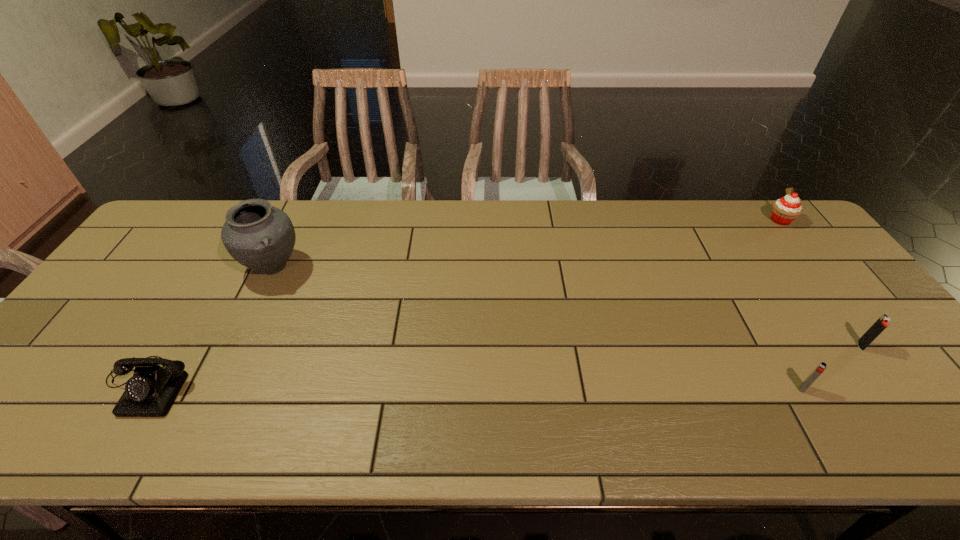
Find the location of a particular element. The height and width of the screenshot is (540, 960). blank space located on the front of the farther igniter is located at coordinates (926, 433).

Identify the location of vacant space located 0.240m on the right of the nearer igniter. (913, 388).

This screenshot has width=960, height=540. I want to click on urn that is at the far edge, so click(257, 235).

Find the location of a particular element. cupcake located in the far edge section of the desktop is located at coordinates (785, 210).

You are a GUI agent. You are given a task and a screenshot of the screen. Output one action in this format:
    pyautogui.click(x=<x>, y=<y>)
    Task: Click on the object situated at the near edge
    The image size is (960, 540).
    Given the screenshot: What is the action you would take?
    pyautogui.click(x=151, y=392)

I want to click on cupcake that is positioned at the right edge, so click(x=785, y=210).

Where is `igniter located at the right edge`? igniter located at the right edge is located at coordinates click(x=876, y=329).

Find the location of a particular element. This screenshot has height=540, width=960. object that is at the far right corner is located at coordinates (785, 210).

At what (x,y) coordinates should I click in order to perform the action: click on free region at the far edge of the desktop. Please return your answer as a coordinate pair (x, y). This screenshot has height=540, width=960. Looking at the image, I should click on (445, 231).

You are a GUI agent. You are given a task and a screenshot of the screen. Output one action in this format:
    pyautogui.click(x=<x>, y=<y>)
    Task: Click on the free region at the near edge of the desktop
    Image resolution: width=960 pixels, height=540 pixels.
    Given the screenshot: What is the action you would take?
    pyautogui.click(x=437, y=422)